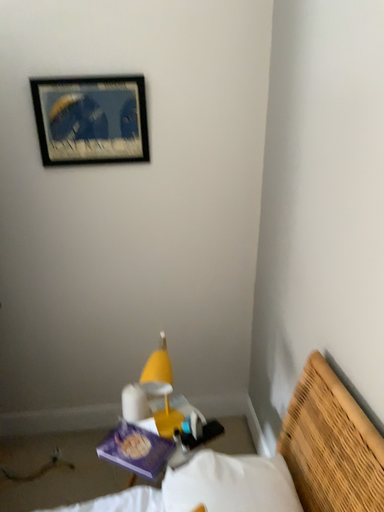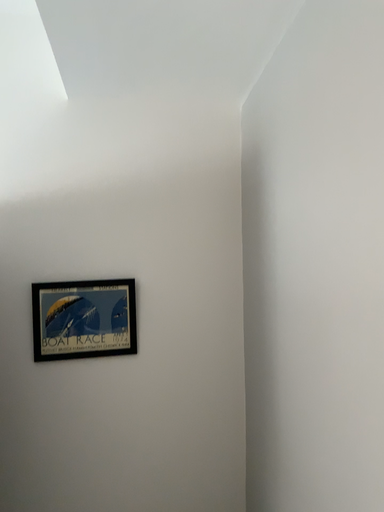
Question: How did the camera likely rotate when shooting the video?

Choices:
 (A) rotated upward
 (B) rotated downward

Answer: (A)